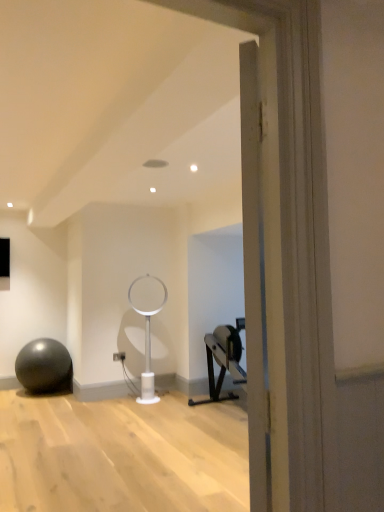
Find the location of `matte gray ball at left`. matte gray ball at left is located at coordinates (44, 366).

Measure the distance between matte gray ball at left and camera.

They are 4.84 meters apart.

Image resolution: width=384 pixels, height=512 pixels. What do you see at coordinates (44, 366) in the screenshot? I see `matte gray ball at left` at bounding box center [44, 366].

Measure the distance between point (28, 385) and camera.

Point (28, 385) is 4.85 meters away from camera.

Describe the element at coordinates (147, 324) in the screenshot. I see `white plastic table lamp at center` at that location.

The width and height of the screenshot is (384, 512). Find the location of `white plastic table lamp at center`. white plastic table lamp at center is located at coordinates (147, 324).

You are a GUI agent. You are given a task and a screenshot of the screen. Output one action in this format:
    pyautogui.click(x=<x>, y=<y>)
    Task: Click on the matte gray ball at left
    
    Given the screenshot: What is the action you would take?
    pyautogui.click(x=44, y=366)

Which is more to the right, matte gray ball at left or white plastic table lamp at center?

From the viewer's perspective, white plastic table lamp at center appears more on the right side.

Which is in front, matte gray ball at left or white plastic table lamp at center?

Positioned in front is white plastic table lamp at center.

Does point (34, 373) lie behind point (135, 310)?

No.

From the image's perspective, would you say matte gray ball at left is shown under white plastic table lamp at center?

Yes.

From a real-world perspective, which object rests below the other?

matte gray ball at left is physically lower.

Considering the relative sizes of matte gray ball at left and white plastic table lamp at center in the image provided, is matte gray ball at left wider than white plastic table lamp at center?

Indeed, matte gray ball at left has a greater width compared to white plastic table lamp at center.

Between matte gray ball at left and white plastic table lamp at center, which one has more height?

white plastic table lamp at center.

Considering the relative sizes of matte gray ball at left and white plastic table lamp at center in the image provided, is matte gray ball at left bigger than white plastic table lamp at center?

Correct, matte gray ball at left is larger in size than white plastic table lamp at center.

Do you think matte gray ball at left is within white plastic table lamp at center, or outside of it?

The correct answer is: outside.

Is matte gray ball at left touching white plastic table lamp at center?

No.

Is matte gray ball at left turned away from white plastic table lamp at center?

No, matte gray ball at left is not facing the opposite direction of white plastic table lamp at center.

You are a GUI agent. You are given a task and a screenshot of the screen. Output one action in this format:
    pyautogui.click(x=<x>, y=<y>)
    Task: Click on the ball behind the white plastic table lamp at center
    The width and height of the screenshot is (384, 512).
    Given the screenshot: What is the action you would take?
    pyautogui.click(x=44, y=366)

Does white plastic table lamp at center appear on the right side of matte gray ball at left?

Correct, you'll find white plastic table lamp at center to the right of matte gray ball at left.

Is the depth of white plastic table lamp at center less than that of matte gray ball at left?

That is True.

Which is behind, point (149, 313) or point (18, 356)?

The point (18, 356) is more distant.

From the image's perspective, who appears lower, white plastic table lamp at center or matte gray ball at left?

matte gray ball at left.

From a real-world perspective, is white plastic table lamp at center on top of matte gray ball at left?

Yes, from a real-world perspective, white plastic table lamp at center is over matte gray ball at left

In terms of width, does white plastic table lamp at center look wider or thinner when compared to matte gray ball at left?

Clearly, white plastic table lamp at center has less width compared to matte gray ball at left.

Can you confirm if white plastic table lamp at center is taller than matte gray ball at left?

Yes, white plastic table lamp at center is taller than matte gray ball at left.

Looking at this image, considering the relative sizes of white plastic table lamp at center and matte gray ball at left in the image provided, is white plastic table lamp at center bigger than matte gray ball at left?

No.

Is matte gray ball at left located within white plastic table lamp at center?

No, matte gray ball at left is not surrounded by white plastic table lamp at center.

Is white plastic table lamp at center directly adjacent to matte gray ball at left?

No, white plastic table lamp at center is not making contact with matte gray ball at left.

In the scene shown: Is white plastic table lamp at center oriented away from matte gray ball at left?

No, white plastic table lamp at center is not facing the opposite direction of matte gray ball at left.

What's the angular difference between white plastic table lamp at center and matte gray ball at left's facing directions?

The facing directions of white plastic table lamp at center and matte gray ball at left are 19.9 degrees apart.

In the scene shown: Measure the distance between white plastic table lamp at center and matte gray ball at left.

white plastic table lamp at center is 3.86 feet away from matte gray ball at left.

Image resolution: width=384 pixels, height=512 pixels. Identify the location of ball lying behind the white plastic table lamp at center. (44, 366).

This screenshot has width=384, height=512. In order to click on ball that appears below the white plastic table lamp at center (from the image's perspective) in this screenshot , I will do `click(44, 366)`.

The height and width of the screenshot is (512, 384). Identify the location of ball on the left of white plastic table lamp at center. (44, 366).